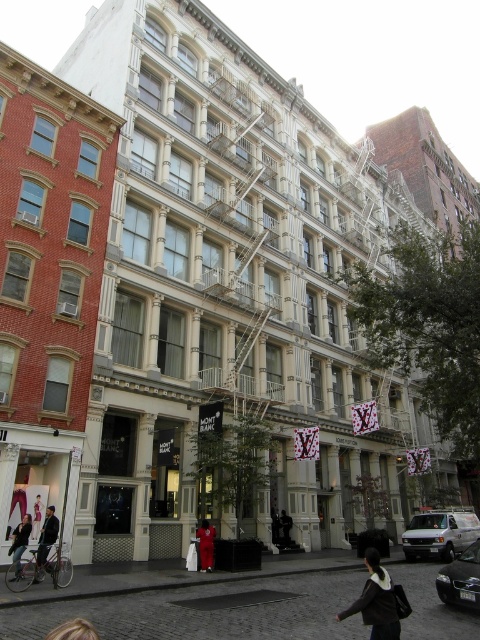
You are standing on the street looking at the buildings. You see a dark blue jeans at lower left and a dark gray fabric jacket at center. Which object is positioned more to the left?

The dark blue jeans at lower left is positioned more to the left than the dark gray fabric jacket at center.

You are a delivery person trying to find the correct address. You see a red fabric person at center and a dark gray fabric jacket at center. Which one is on the left side?

The red fabric person at center is positioned on the left side of the dark gray fabric jacket at center, so the red fabric person at center is on the left.

You are a delivery person standing at the dark brown leather jacket at lower right and need to reach the matte black jacket at lower left to deliver a package. The delivery robot you are using has a maximum range of 20 meters. Can the robot make the delivery without needing a recharge?

The distance between the dark brown leather jacket at lower right and the matte black jacket at lower left is 23.43 meters. Since the robot can only travel 20 meters before needing a recharge, it cannot make the delivery without recharging.